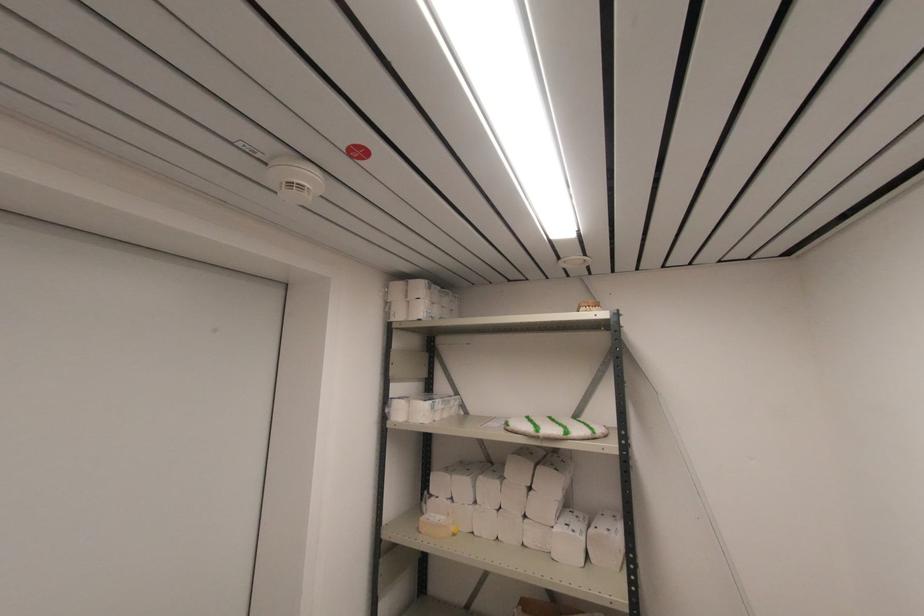
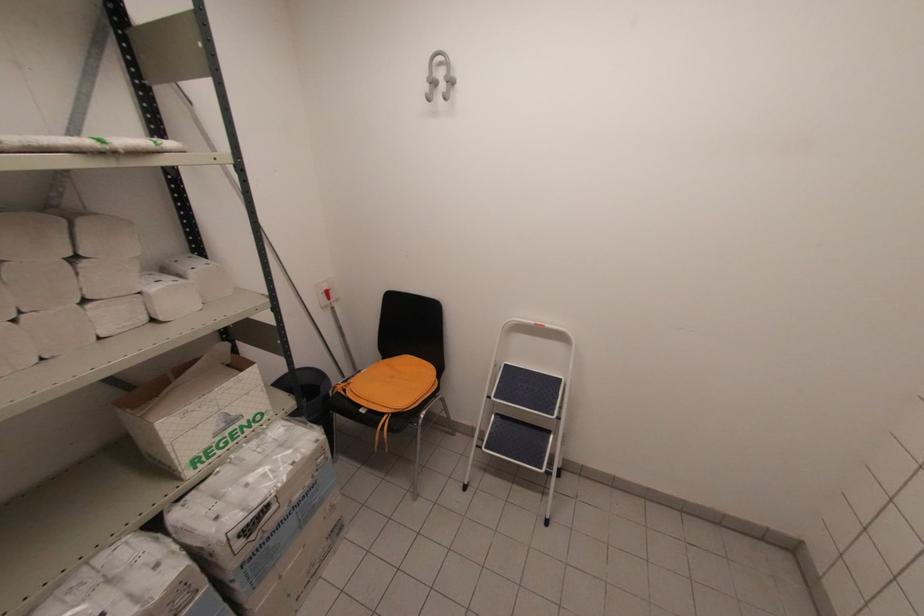
Where in the second image is the point corresponding to [529,485] from the first image?

(71, 254)